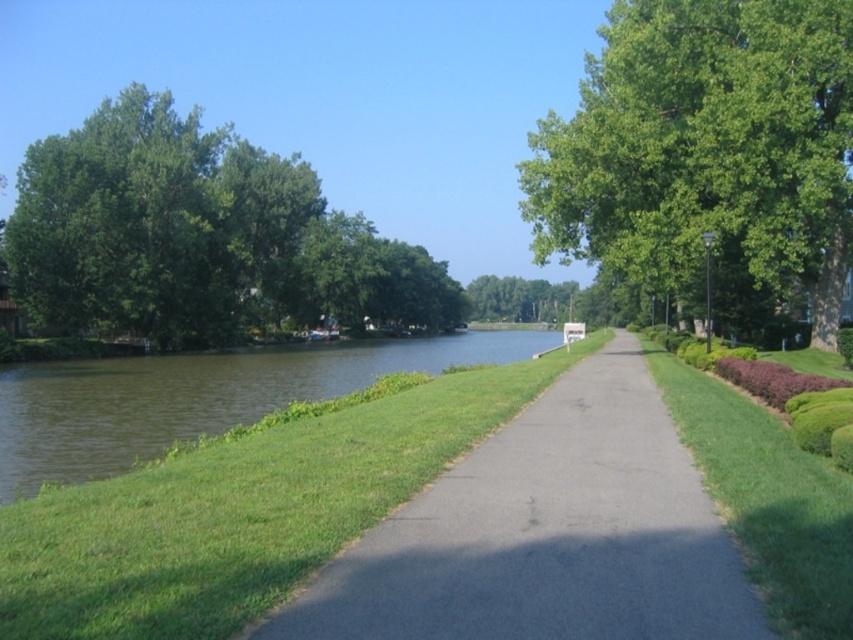
Is point (834, 164) closer to viewer compared to point (55, 140)?

That is True.

Does green leafy tree at upper right have a greater width compared to green leafy tree at upper left?

Incorrect, green leafy tree at upper right's width does not surpass green leafy tree at upper left's.

Is point (666, 51) less distant than point (120, 310)?

That is True.

This screenshot has height=640, width=853. I want to click on green leafy tree at upper right, so click(x=706, y=147).

Does green grass at center have a larger size compared to green leafy tree at center?

Actually, green grass at center might be smaller than green leafy tree at center.

Find the location of a particular element. green grass at center is located at coordinates (241, 509).

Between gray asphalt path at center and green leafy tree at center, which one appears on the left side from the viewer's perspective?

gray asphalt path at center

Image resolution: width=853 pixels, height=640 pixels. Describe the element at coordinates (546, 532) in the screenshot. I see `gray asphalt path at center` at that location.

The width and height of the screenshot is (853, 640). Describe the element at coordinates (546, 532) in the screenshot. I see `gray asphalt path at center` at that location.

What are the coordinates of `gray asphalt path at center` in the screenshot? It's located at (546, 532).